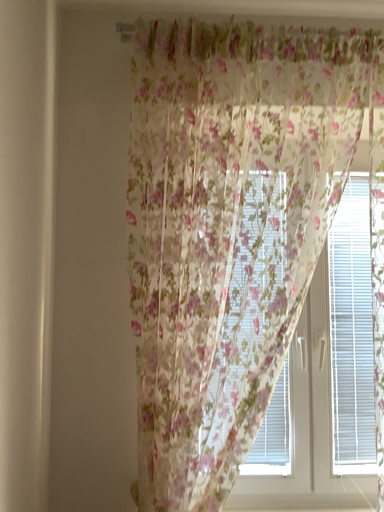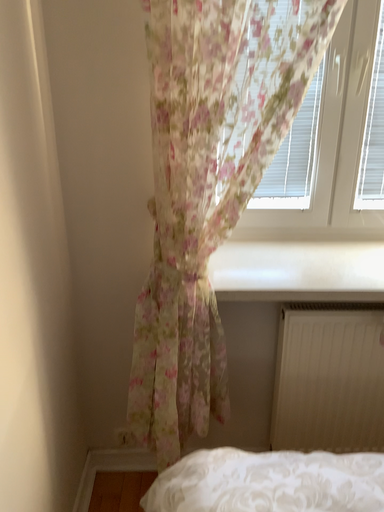
Question: Which way did the camera rotate in the video?

Choices:
 (A) rotated upward
 (B) rotated downward

Answer: (B)